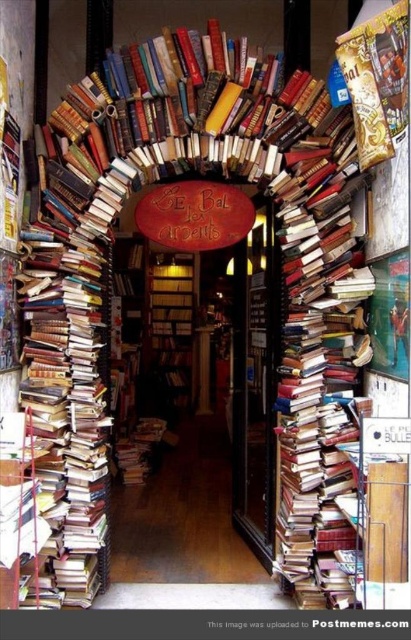
Can you confirm if wooden door at center is positioned below wooden bookshelf at center?

Incorrect, wooden door at center is not positioned below wooden bookshelf at center.

Which is behind, point (196, 273) or point (161, 269)?

Point (196, 273)

Between point (265, 301) and point (159, 330), which one is positioned in front?

Point (265, 301)

Where is `wooden door at center`? The height and width of the screenshot is (640, 411). wooden door at center is located at coordinates pos(205,417).